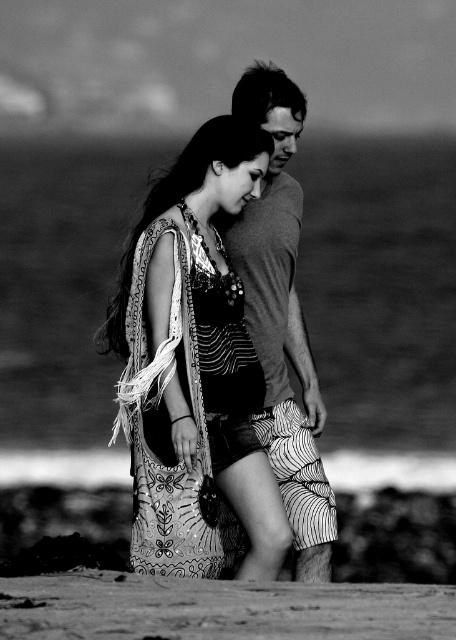
Question: Among these objects, which one is nearest to the camera?

Choices:
 (A) matte gray t-shirt at center
 (B) patterned fabric dress at center

Answer: (B)

Question: Can you confirm if patterned fabric dress at center is positioned below matte gray t-shirt at center?

Choices:
 (A) yes
 (B) no

Answer: (B)

Question: Which of these objects is positioned farthest from the smooth sand at lower center?

Choices:
 (A) matte gray t-shirt at center
 (B) patterned fabric dress at center

Answer: (A)

Question: Does smooth sand at lower center appear on the left side of matte gray t-shirt at center?

Choices:
 (A) yes
 (B) no

Answer: (B)

Question: Which point is farther from the camera taking this photo?

Choices:
 (A) (39, 636)
 (B) (260, 74)

Answer: (B)

Question: Is smooth sand at lower center to the left of matte gray t-shirt at center from the viewer's perspective?

Choices:
 (A) yes
 (B) no

Answer: (B)